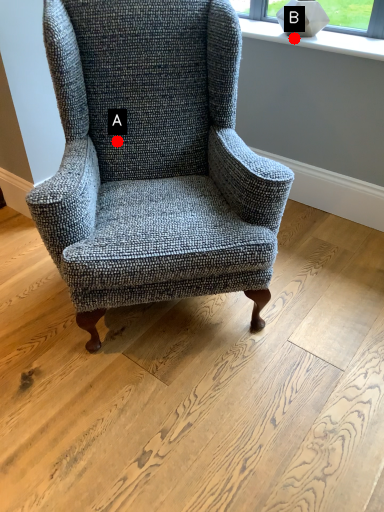
Question: Two points are circled on the image, labeled by A and B beside each circle. Which point is farther to the camera?

Choices:
 (A) A is further
 (B) B is further

Answer: (B)